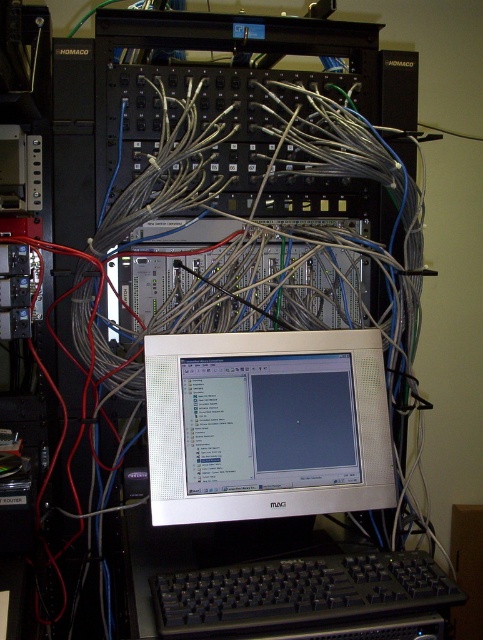
Can you confirm if white glossy monitor at center is positioned to the left of black plastic keyboard at lower center?

Correct, you'll find white glossy monitor at center to the left of black plastic keyboard at lower center.

Is point (297, 360) behind point (233, 609)?

That is True.

What are the coordinates of `white glossy monitor at center` in the screenshot? It's located at (267, 426).